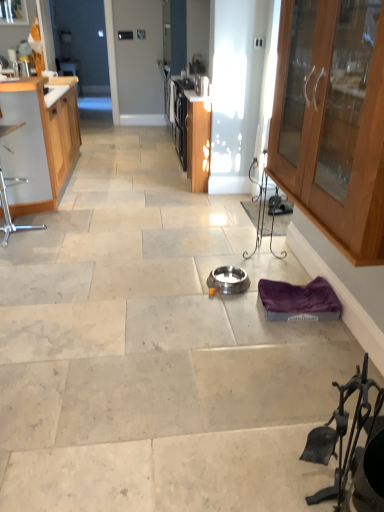
The width and height of the screenshot is (384, 512). I want to click on blank space to the left of satin silver bowl at center, positioned as the first appliance in bottom-to-top order, so click(185, 283).